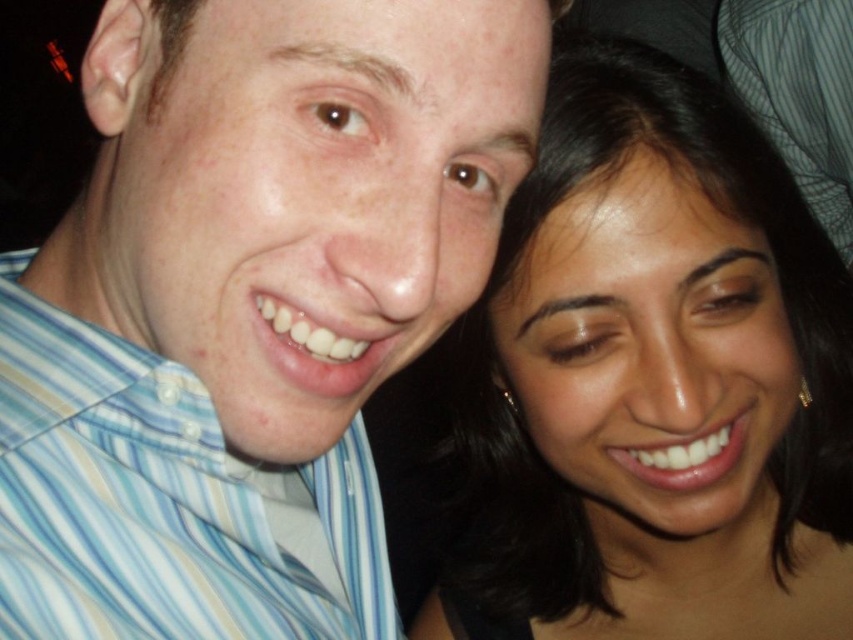
Question: Can you confirm if dark brown hair at upper right is smaller than blue striped shirt at upper left?

Choices:
 (A) yes
 (B) no

Answer: (B)

Question: Can you confirm if dark brown hair at upper right is positioned below blue striped shirt at upper left?

Choices:
 (A) no
 (B) yes

Answer: (A)

Question: Which object appears closest to the camera in this image?

Choices:
 (A) dark brown hair at upper right
 (B) blue striped shirt at upper left

Answer: (B)

Question: Is dark brown hair at upper right bigger than blue striped shirt at upper left?

Choices:
 (A) yes
 (B) no

Answer: (A)

Question: Among these points, which one is nearest to the camera?

Choices:
 (A) (345, 595)
 (B) (520, 627)

Answer: (A)